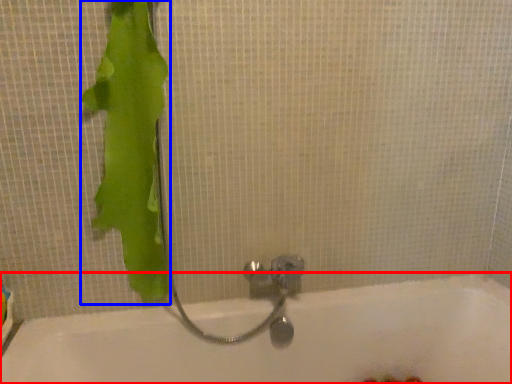
Question: Which point is closer to the camera, bathtub (highlighted by a red box) or animal (highlighted by a blue box)?

Choices:
 (A) bathtub
 (B) animal

Answer: (A)